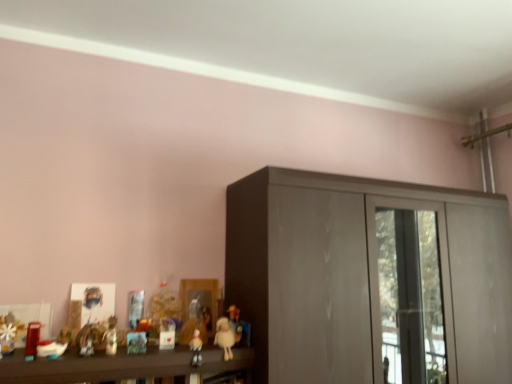
Question: Is glossy wood cupboard at center shorter than fluffy white teddy bear at lower center, marked as the 2th toy in a right-to-left arrangement?

Choices:
 (A) no
 (B) yes

Answer: (A)

Question: Is glossy wood cupboard at center next to fluffy white teddy bear at lower center, marked as the 2th toy in a right-to-left arrangement, and touching it?

Choices:
 (A) yes
 (B) no

Answer: (B)

Question: From a real-world perspective, is glossy wood cupboard at center under fluffy white teddy bear at lower center, marked as the 2th toy in a right-to-left arrangement?

Choices:
 (A) yes
 (B) no

Answer: (B)

Question: Is fluffy white teddy bear at lower center, marked as the 2th toy in a right-to-left arrangement, completely or partially inside glossy wood cupboard at center?

Choices:
 (A) no
 (B) yes

Answer: (A)

Question: Can you confirm if glossy wood cupboard at center is wider than fluffy white teddy bear at lower center, marked as the 2th toy in a right-to-left arrangement?

Choices:
 (A) no
 (B) yes

Answer: (B)

Question: From the image's perspective, is glossy wood cupboard at center located beneath fluffy white teddy bear at lower center, which is the 6th toy in left-to-right order?

Choices:
 (A) yes
 (B) no

Answer: (B)

Question: Can you confirm if white matte figurine at center, acting as the fourth toy starting from the right, is wider than matte plastic doll at center, which is the 3th toy from right to left?

Choices:
 (A) yes
 (B) no

Answer: (B)

Question: Is matte plastic doll at center, positioned as the fifth toy in left-to-right order, surrounded by white matte figurine at center, positioned as the fourth toy in left-to-right order?

Choices:
 (A) yes
 (B) no

Answer: (B)

Question: From a real-world perspective, is white matte figurine at center, positioned as the fourth toy in left-to-right order, under matte plastic doll at center, which is the 3th toy from right to left?

Choices:
 (A) yes
 (B) no

Answer: (B)

Question: Does white matte figurine at center, positioned as the fourth toy in left-to-right order, have a lesser width compared to matte plastic doll at center, which is the 3th toy from right to left?

Choices:
 (A) yes
 (B) no

Answer: (A)

Question: Is white matte figurine at center, acting as the fourth toy starting from the right, far away from matte plastic doll at center, which is the 3th toy from right to left?

Choices:
 (A) no
 (B) yes

Answer: (A)

Question: Does white matte figurine at center, acting as the fourth toy starting from the right, have a greater height compared to matte plastic doll at center, which is the 3th toy from right to left?

Choices:
 (A) yes
 (B) no

Answer: (B)

Question: From a real-world perspective, is fluffy white teddy bear at lower center, which is the 6th toy in left-to-right order, positioned under matte yellow plush at center, marked as the first toy in a right-to-left arrangement, based on gravity?

Choices:
 (A) yes
 (B) no

Answer: (A)